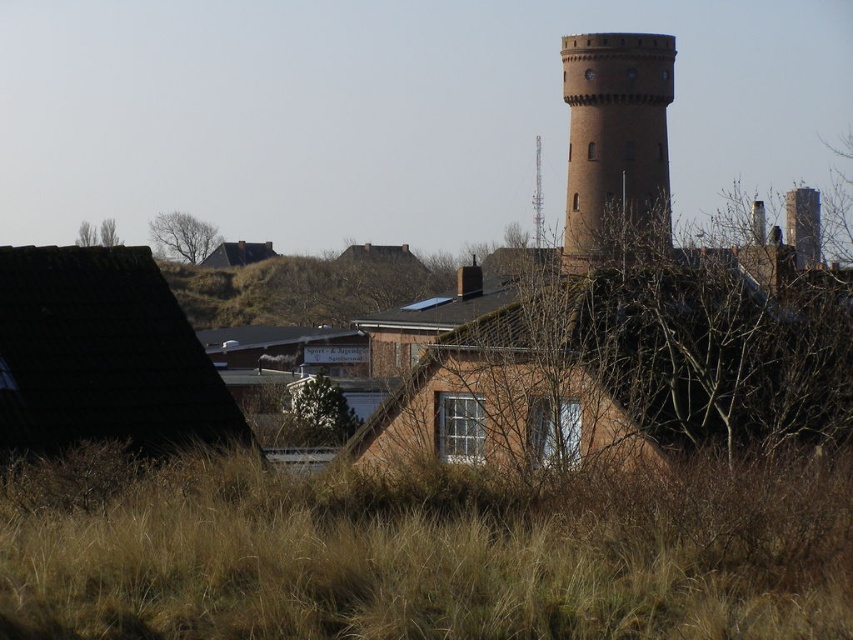
You are a landscape photographer planning to capture the brown brick tower at upper center and the green leafy tree at center in a single frame. Given their sizes in the image, which one would you focus on to ensure it is the dominant subject?

The brown brick tower at upper center should be the focus since it occupies more space than the green leafy tree at center according to the description.

You are standing in the field of tall dry grasses and want to walk towards the brown brick tower at upper center. Which direction should you walk relative to the green leafy tree at center?

You should walk to the right of the green leafy tree at center to reach the brown brick tower at upper center because the green leafy tree at center is positioned on the left side of the brown brick tower at upper center.

You are a bird looking for a nesting spot. You see the green leafy tree at center and the matte brown chimney at upper center. Which one would provide a larger area for nesting?

The green leafy tree at center has a larger size compared to the matte brown chimney at upper center, so it would provide a larger area for nesting.